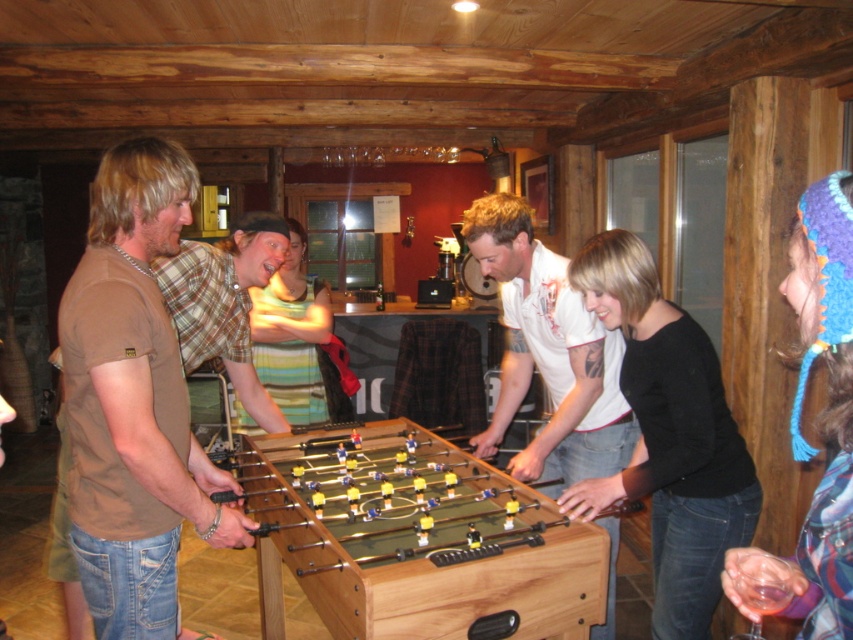
You are a guest at the cabin and want to join the foosball game. You are standing 1.5 meters away from the wooden foosball table at center. Can you reach the plaid shirt at center without moving closer than your current position?

The wooden foosball table at center is 1.04 meters away from the plaid shirt at center. Since you are already 1.5 meters away from the table, you would need to move closer to reach the plaid shirt at center, so you cannot reach it without moving closer.

You are planning to move the wooden foosball table at center and the plaid shirt at center into a smaller room. Which object should you move first to ensure they both fit?

The plaid shirt at center should be moved first since the wooden foosball table at center is larger and requires more space, so moving it first would allow proper placement.

From the picture: You are standing in the cabin and want to pick up the blue knitted hat at upper right. Which object do you need to walk around or past first, the wooden foosball table at center or the hat itself?

The wooden foosball table at center is closer to you than the blue knitted hat at upper right, so you need to walk around or past the wooden foosball table at center first to reach the blue knitted hat at upper right.